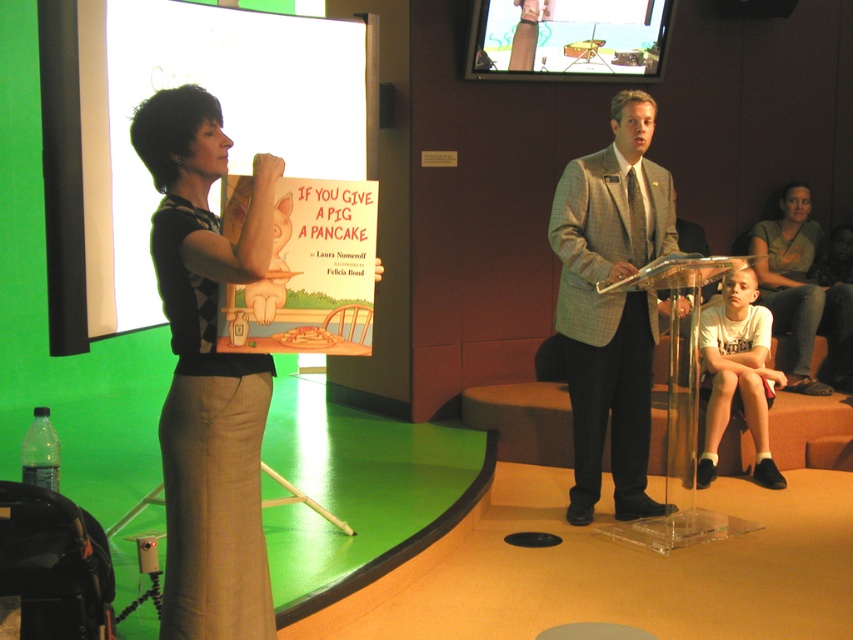
You are a stagehand who needs to adjust the microphone stand between the gray checkered suit at center and the matte plastic tv at upper center. The microphone stand requires at least 1.5 meters of space to be placed safely. Can you fit it there?

The distance between the gray checkered suit at center and the matte plastic tv at upper center is 1.81 meters, which is more than the required 1.5 meters. Therefore, the microphone stand can be safely placed there.

You are an attendee at the event and want to know which object is larger between the white paper at upper left and the beige textured skirt at left. Can you determine this based on the image?

The white paper at upper left is bigger than the beige textured skirt at left according to the image description.

From the picture: You are an attendee at the event and want to take a photo of the white paper at upper left. Where should you position yourself to capture it in the frame?

The white paper at upper left is located at point (223, 115), so you should position yourself in the upper left area of the scene to capture it in the frame.